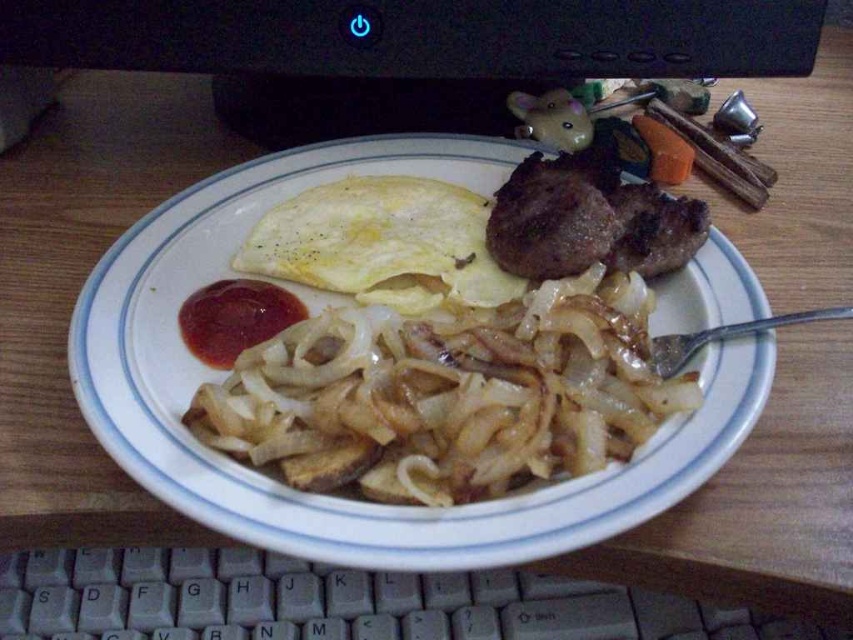
You are trying to determine the distance from the camera to two points on the desk. The first point is at coordinate point [500,268] and the second is at point [236,339]. Which point is closer to the camera?

Point [500,268] is further to the camera than point [236,339], so the second point is closer to the camera.

You are a food delivery person who needs to identify the position of the red glossy ketchup at center and orange smooth carrot at upper right on the plate. Which one is higher up on the plate?

The orange smooth carrot at upper right is higher up on the plate than the red glossy ketchup at center because the red glossy ketchup at center is located below it.

You are trying to place a 25 inch ruler between the point at (605, 195) and the edge of the plate. Will it fit?

The distance between the point at (605, 195) and the edge of the plate is 24.95 inches, so the 25 inch ruler will not fit between them.